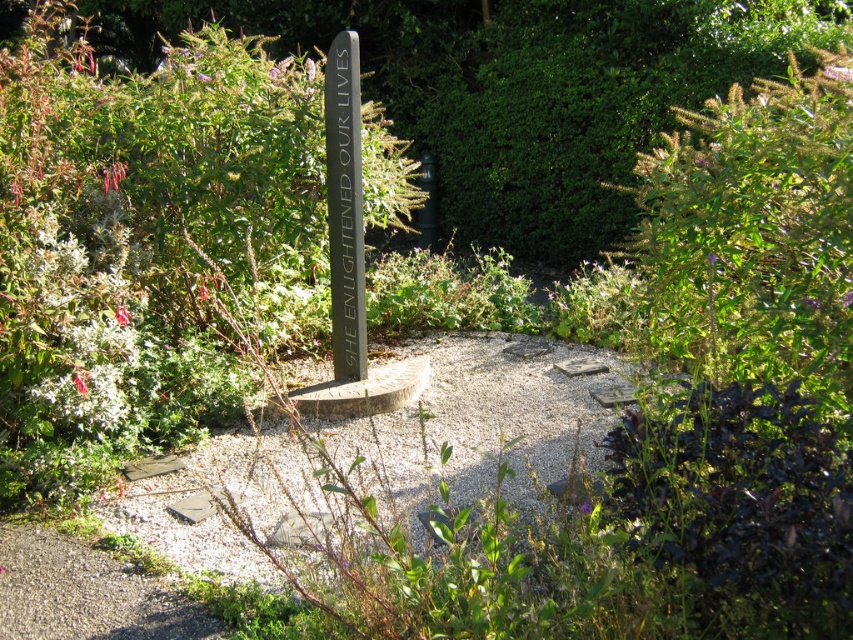
Question: Which point is farther to the camera?

Choices:
 (A) black polished stone sign at center
 (B) black polished stone marker at center

Answer: (A)

Question: Which point is closer to the camera?

Choices:
 (A) (352, 292)
 (B) (352, 244)

Answer: (B)

Question: Does black polished stone sign at center come behind black polished stone marker at center?

Choices:
 (A) no
 (B) yes

Answer: (B)

Question: Does black polished stone sign at center have a larger size compared to black polished stone marker at center?

Choices:
 (A) yes
 (B) no

Answer: (A)

Question: Is black polished stone sign at center to the left of black polished stone marker at center from the viewer's perspective?

Choices:
 (A) yes
 (B) no

Answer: (A)